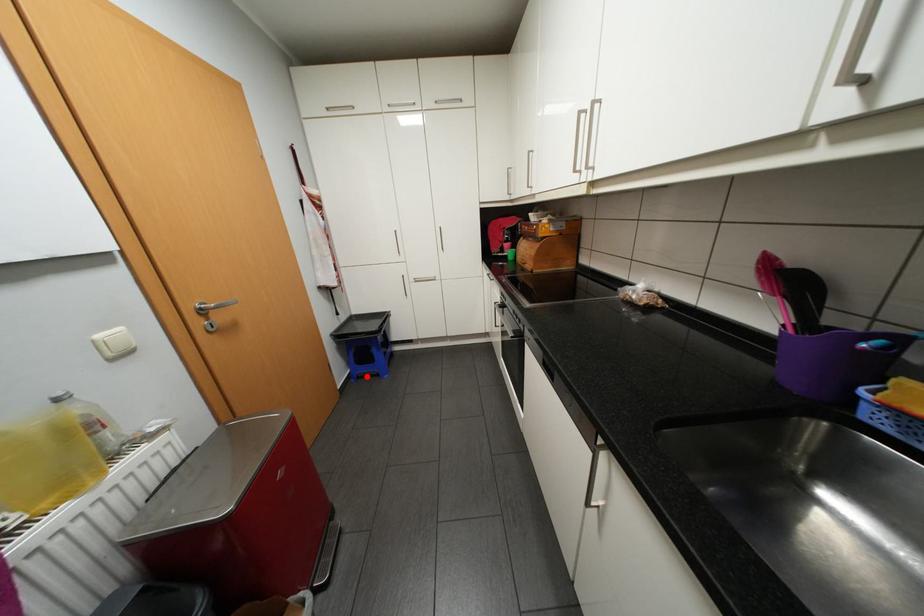
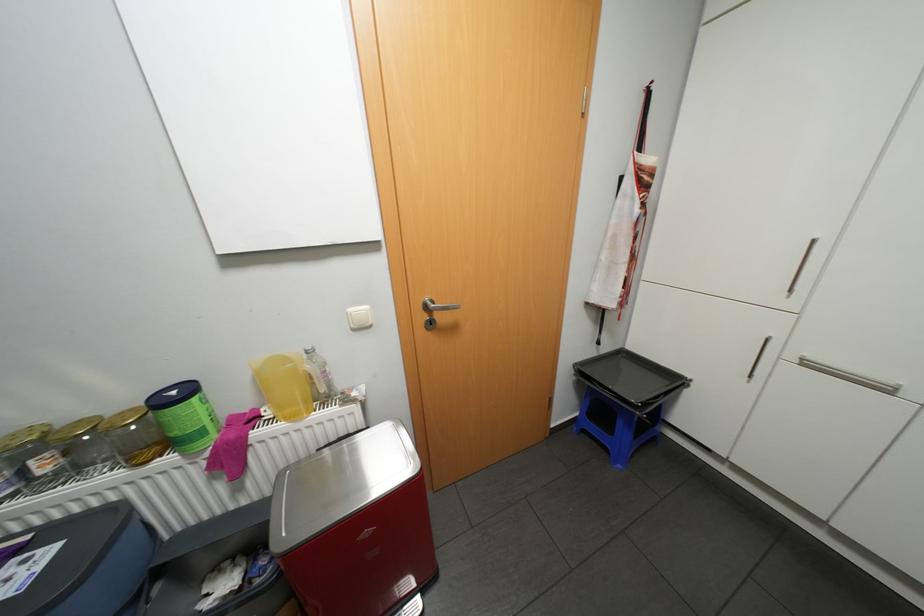
Question: I am providing you with two images of the same scene from different viewpoints. Given a red point in image1, look at the same physical point in image2. Is it:

Choices:
 (A) Closer to the viewpoint
 (B) Farther from the viewpoint

Answer: (B)